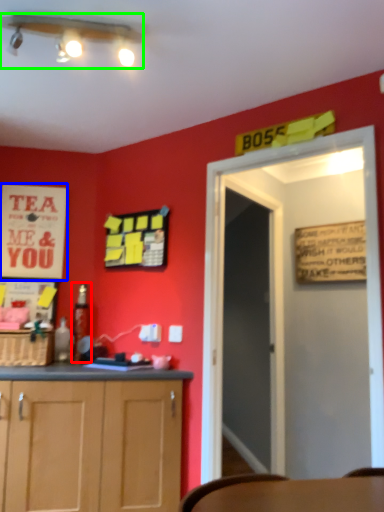
Question: Which object is the closest to the bottle (highlighted by a red box)? Choose among these: poster (highlighted by a blue box) or light fixture (highlighted by a green box).

Choices:
 (A) poster
 (B) light fixture

Answer: (A)